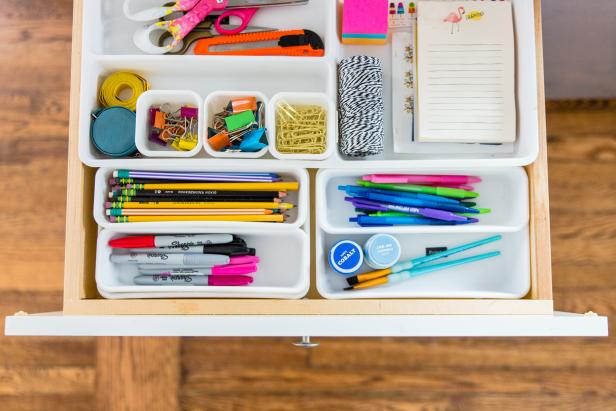
This screenshot has width=616, height=411. I want to click on binder clips, so click(190, 143), click(192, 108), click(158, 116), click(166, 137), click(215, 137), click(256, 139), click(236, 121), click(244, 103).